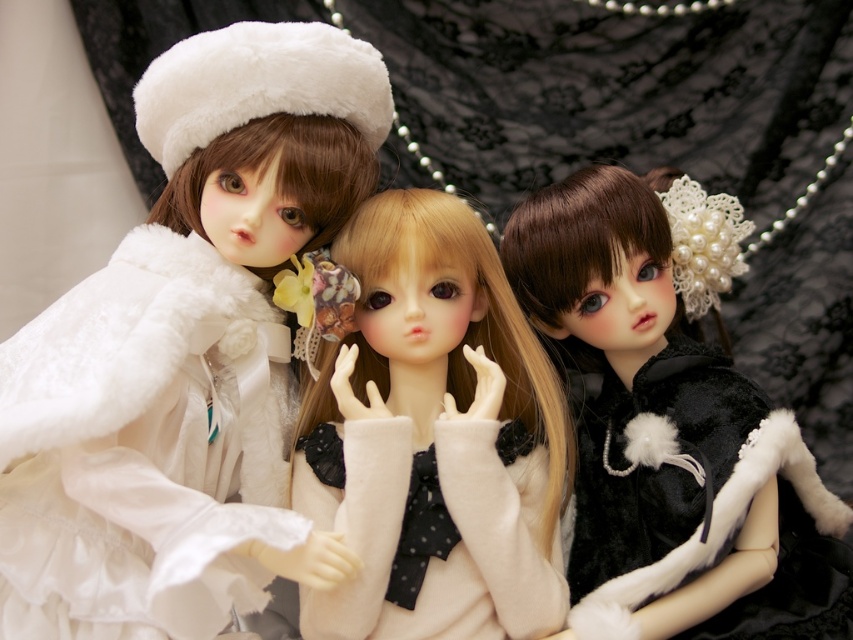
Does matte white sweater at center appear under white fuzzy sweater at center?

No, matte white sweater at center is not below white fuzzy sweater at center.

Who is more distant from viewer, [502,492] or [509,624]?

Point [509,624]

This screenshot has width=853, height=640. Find the location of `matte white sweater at center`. matte white sweater at center is located at coordinates (433, 438).

Is velvet black coat at center bigger than matte white sweater at center?

Correct, velvet black coat at center is larger in size than matte white sweater at center.

Is point (509, 278) more distant than point (410, 480)?

Yes.

Describe the element at coordinates (672, 426) in the screenshot. I see `velvet black coat at center` at that location.

Locate an element on the screen. The height and width of the screenshot is (640, 853). velvet black coat at center is located at coordinates (672, 426).

Who is lower down, white fluffy hat at upper left or matte white sweater at center?

matte white sweater at center

Looking at this image, can you confirm if white fluffy hat at upper left is wider than matte white sweater at center?

Indeed, white fluffy hat at upper left has a greater width compared to matte white sweater at center.

Who is more distant from viewer, (86,358) or (428,534)?

Point (428,534)

The image size is (853, 640). In order to click on white fluffy hat at upper left in this screenshot , I will do pyautogui.click(x=184, y=352).